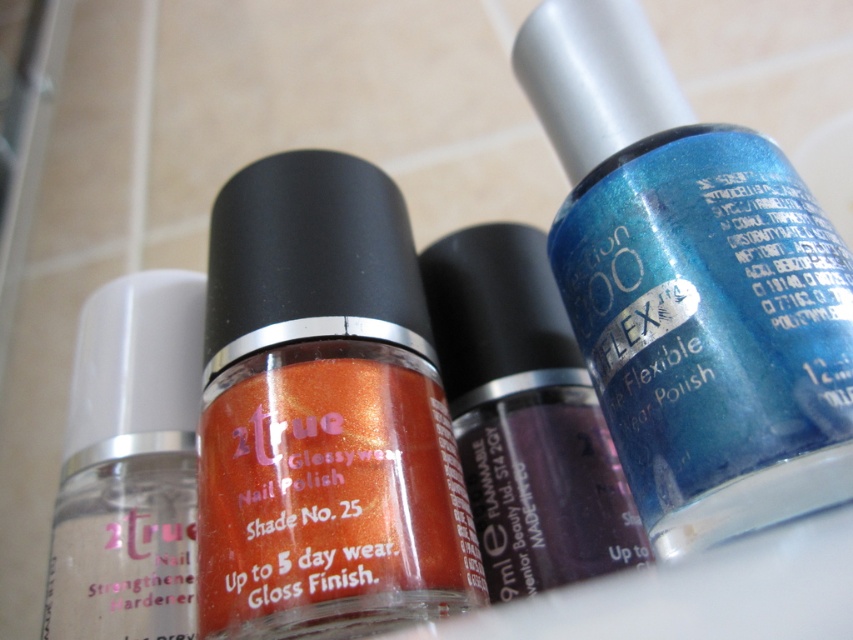
Question: Which object is positioned closest to the transparent matte nail strengthener at left?

Choices:
 (A) shiny purple nail polish at center
 (B) shiny blue nail polish at center
 (C) shiny orange nail polish at center

Answer: (C)

Question: Which of these objects is positioned closest to the shiny blue nail polish at center?

Choices:
 (A) shiny purple nail polish at center
 (B) shiny orange nail polish at center
 (C) transparent matte nail strengthener at left

Answer: (A)

Question: Which point is farther to the camera?

Choices:
 (A) (457, 243)
 (B) (399, 308)

Answer: (A)

Question: Does shiny blue nail polish at center lie behind shiny purple nail polish at center?

Choices:
 (A) yes
 (B) no

Answer: (B)

Question: Is shiny blue nail polish at center wider than shiny purple nail polish at center?

Choices:
 (A) no
 (B) yes

Answer: (B)

Question: Can you confirm if shiny orange nail polish at center is thinner than shiny purple nail polish at center?

Choices:
 (A) no
 (B) yes

Answer: (A)